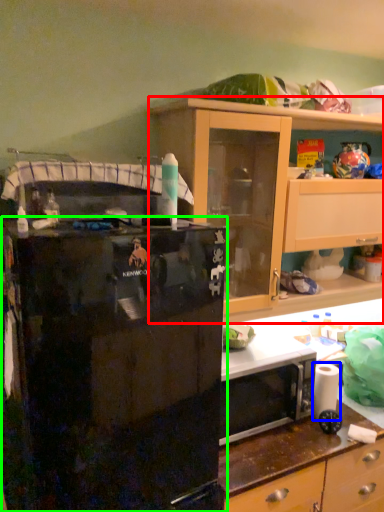
Question: Based on their relative distances, which object is nearer to cabinetry (highlighted by a red box)? Choose from toilet paper (highlighted by a blue box) and refrigerator (highlighted by a green box).

Choices:
 (A) toilet paper
 (B) refrigerator

Answer: (B)